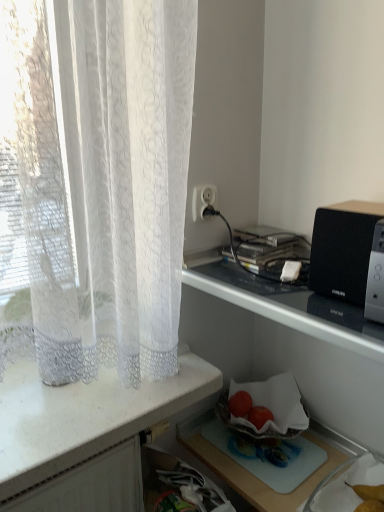
Locate an element on the screen. Image resolution: width=384 pixels, height=512 pixels. free location above translucent glass bowl at lower center (from a real-world perspective) is located at coordinates (268, 445).